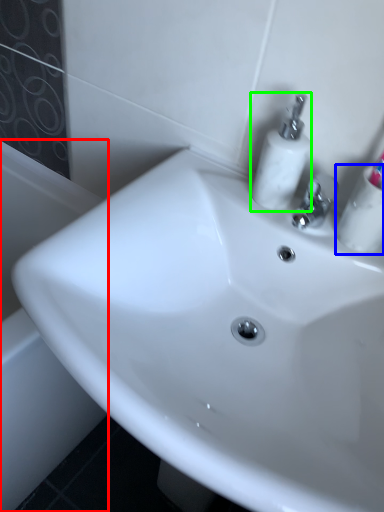
Question: Which object is positioned closest to bath (highlighted by a red box)? Select from mouthwash (highlighted by a blue box) and soap dispenser (highlighted by a green box).

Choices:
 (A) mouthwash
 (B) soap dispenser

Answer: (B)